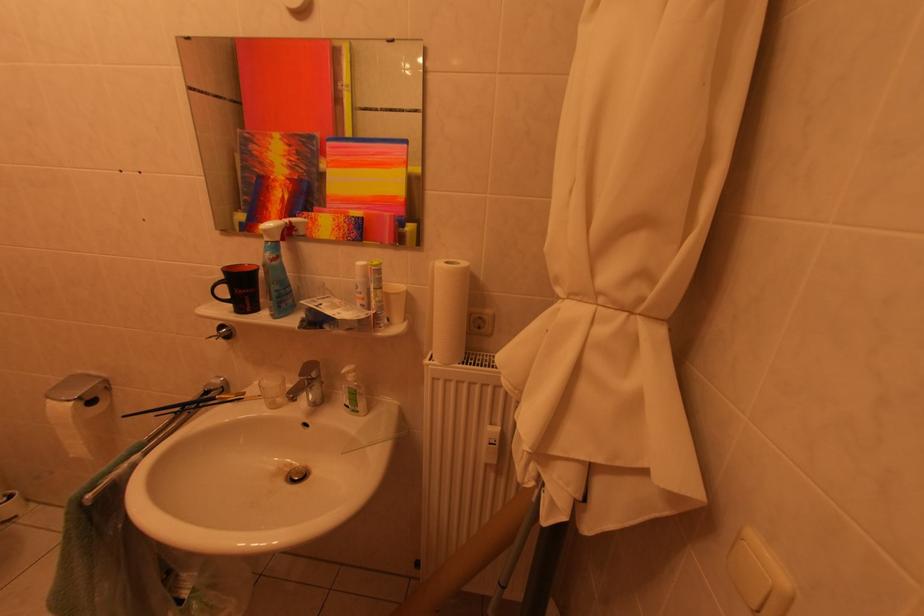
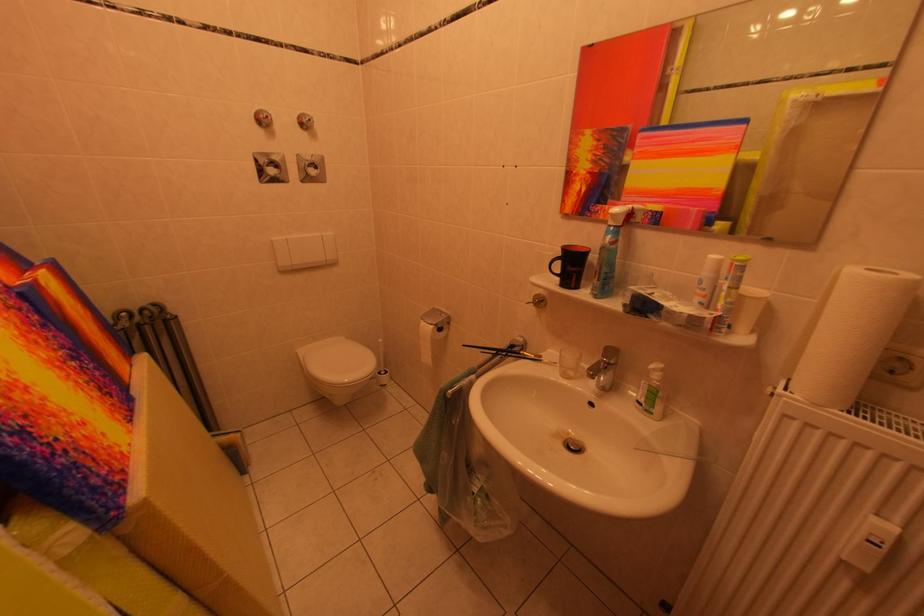
Where in the second image is the point corresponding to (x=225, y=341) from the first image?

(541, 308)